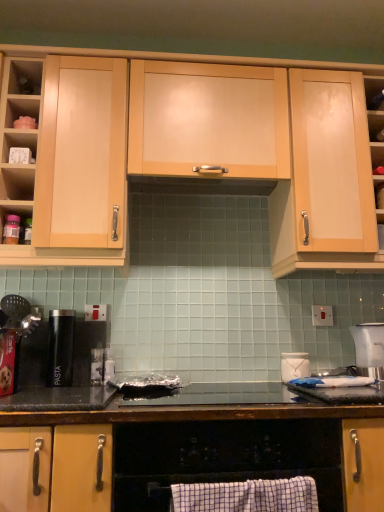
Question: From a real-world perspective, does white plastic clock at upper left, the 2th shelf in the bottom-to-top sequence, sit lower than white plastic electric outlet at center right?

Choices:
 (A) no
 (B) yes

Answer: (A)

Question: Is white plastic clock at upper left, marked as the second shelf in a left-to-right arrangement, beside white plastic electric outlet at center right?

Choices:
 (A) no
 (B) yes

Answer: (A)

Question: Is white plastic clock at upper left, marked as the second shelf in a right-to-left arrangement, turned away from white plastic electric outlet at center right?

Choices:
 (A) no
 (B) yes

Answer: (A)

Question: Is white plastic clock at upper left, which appears as the 2th shelf when viewed from the top, at the left side of white plastic electric outlet at center right?

Choices:
 (A) yes
 (B) no

Answer: (A)

Question: Is white plastic electric outlet at center right surrounded by white plastic clock at upper left, the 2th shelf in the bottom-to-top sequence?

Choices:
 (A) yes
 (B) no

Answer: (B)

Question: From the image's perspective, is wooden shelf at upper right, which is counted as the third shelf, starting from the left, above or below black matte pasta canister at left?

Choices:
 (A) below
 (B) above

Answer: (B)

Question: In terms of width, does wooden shelf at upper right, the third shelf from the top, look wider or thinner when compared to black matte pasta canister at left?

Choices:
 (A) thin
 (B) wide

Answer: (A)

Question: From a real-world perspective, is wooden shelf at upper right, which is counted as the third shelf, starting from the left, above or below black matte pasta canister at left?

Choices:
 (A) below
 (B) above

Answer: (B)

Question: In the image, is wooden shelf at upper right, the third shelf from the top, positioned in front of or behind black matte pasta canister at left?

Choices:
 (A) front
 (B) behind

Answer: (B)

Question: Is point click(362, 327) closer or farther from the camera than point click(354, 222)?

Choices:
 (A) closer
 (B) farther

Answer: (B)

Question: Relative to light wood cabinet at upper right, marked as the third cabinetry in a top-to-bottom arrangement, is white plastic blender at right in front or behind?

Choices:
 (A) front
 (B) behind

Answer: (B)

Question: In terms of size, does white plastic blender at right appear bigger or smaller than light wood cabinet at upper right, marked as the third cabinetry in a top-to-bottom arrangement?

Choices:
 (A) small
 (B) big

Answer: (A)

Question: Choose the correct answer: Is white plastic blender at right inside light wood cabinet at upper right, the 2th cabinetry in the bottom-to-top sequence, or outside it?

Choices:
 (A) outside
 (B) inside

Answer: (A)

Question: Is matte wood cabinet at center, which is the 1th cabinetry from top to bottom, inside or outside of matte wood cabinet at left, which is counted as the 3th cabinetry, starting from the bottom?

Choices:
 (A) outside
 (B) inside

Answer: (A)

Question: Considering the positions of matte wood cabinet at center, which is the 1th cabinetry from top to bottom, and matte wood cabinet at left, the 2th cabinetry in the top-to-bottom sequence, in the image, is matte wood cabinet at center, which is the 1th cabinetry from top to bottom, taller or shorter than matte wood cabinet at left, the 2th cabinetry in the top-to-bottom sequence,?

Choices:
 (A) short
 (B) tall

Answer: (A)